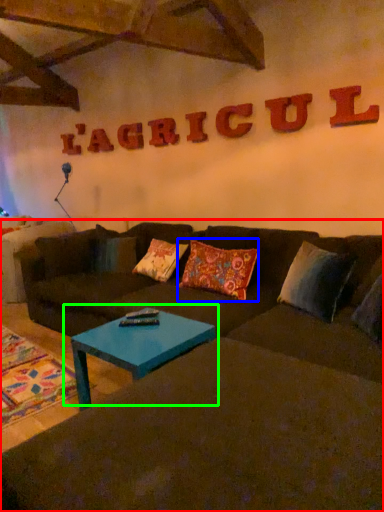
Question: Which object is positioned farthest from studio couch (highlighted by a red box)? Select from pillow (highlighted by a blue box) and coffee table (highlighted by a green box).

Choices:
 (A) pillow
 (B) coffee table

Answer: (A)